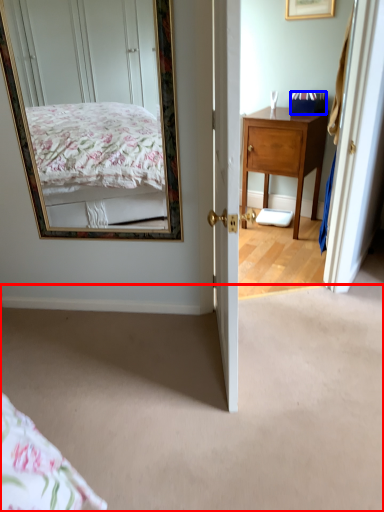
Question: Which object appears farthest to the camera in this image, plain (highlighted by a red box) or box (highlighted by a blue box)?

Choices:
 (A) plain
 (B) box

Answer: (B)